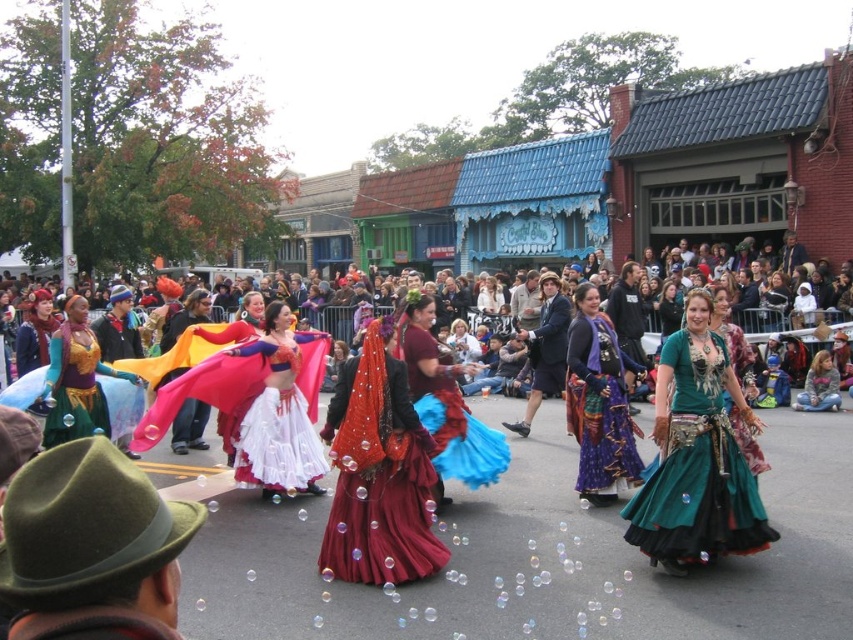
Between point (701, 529) and point (799, 396), which one is positioned behind?

Point (799, 396)

Is point (692, 301) positioned in front of point (833, 406)?

Yes, point (692, 301) is in front of point (833, 406).

This screenshot has width=853, height=640. Find the location of `green metallic skirt at center`. green metallic skirt at center is located at coordinates (697, 456).

Can you confirm if purple satin dress at center is shorter than maroon satin skirt at center?

In fact, purple satin dress at center may be taller than maroon satin skirt at center.

Does point (579, 337) come farther from viewer compared to point (451, 384)?

Yes, point (579, 337) is farther from viewer.

Locate an element on the screen. purple satin dress at center is located at coordinates point(599,403).

Which is more to the left, matte red dress at center or purple satin dress at center?

matte red dress at center

At what (x,y) coordinates should I click in order to perform the action: click on matte red dress at center. Please return your answer as a coordinate pair (x, y). The image size is (853, 640). Looking at the image, I should click on (257, 404).